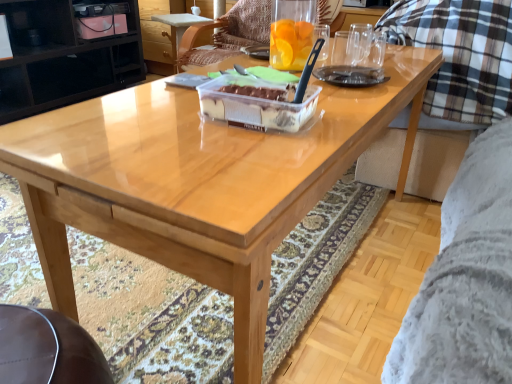
Locate an element on the screen. The height and width of the screenshot is (384, 512). vacant space positioned to the left of translucent plastic cake at center is located at coordinates (163, 116).